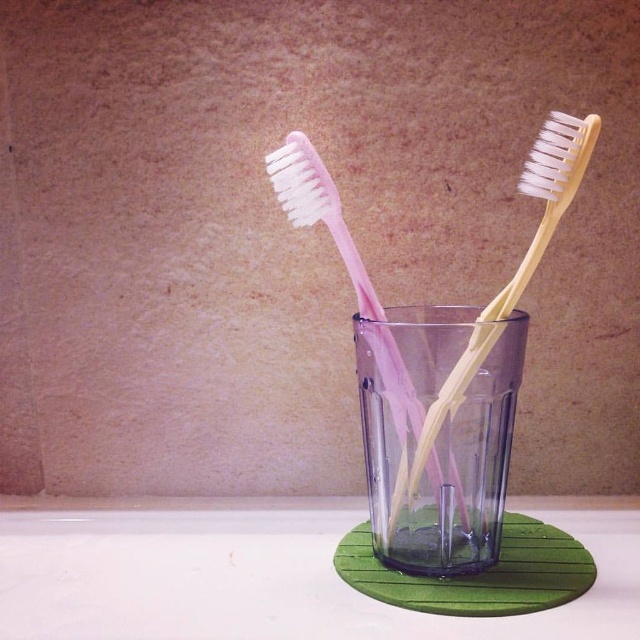
Question: Which object is the closest to the transparent plastic cup at center?

Choices:
 (A) pink plastic toothbrush at center
 (B) yellow matte toothbrush at center

Answer: (A)

Question: Among these points, which one is nearest to the camera?

Choices:
 (A) (572, 116)
 (B) (445, 477)

Answer: (A)

Question: Does yellow matte toothbrush at center appear on the left side of pink plastic toothbrush at center?

Choices:
 (A) yes
 (B) no

Answer: (B)

Question: Is transparent plastic cup at center thinner than yellow matte toothbrush at center?

Choices:
 (A) no
 (B) yes

Answer: (B)

Question: Is transparent plastic cup at center bigger than yellow matte toothbrush at center?

Choices:
 (A) yes
 (B) no

Answer: (B)

Question: Which point is farther from the camera taking this photo?

Choices:
 (A) (410, 362)
 (B) (520, 294)

Answer: (B)